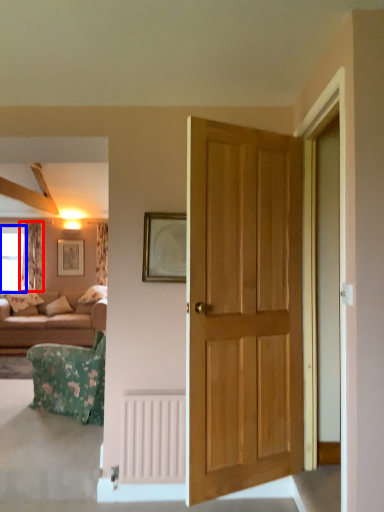
Question: Which of the following is the closest to the observer, curtain (highlighted by a red box) or window (highlighted by a blue box)?

Choices:
 (A) curtain
 (B) window

Answer: (A)